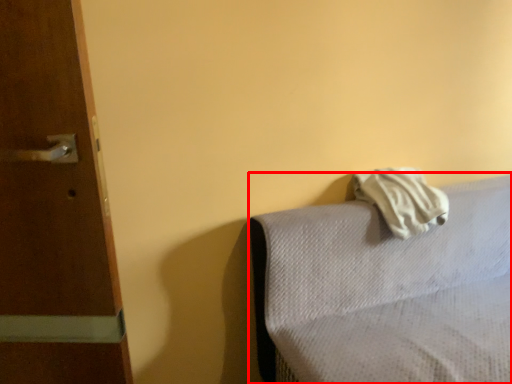
Question: From the image's perspective, what is the correct spatial relationship of furniture (annotated by the red box) in relation to bath towel?

Choices:
 (A) above
 (B) below

Answer: (B)